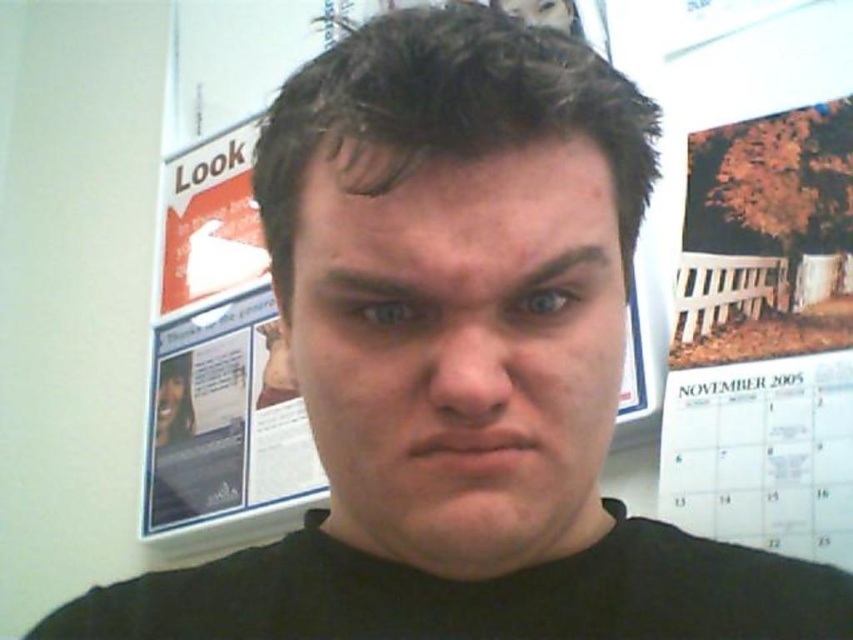
Between matte skin face at center and white paper calendar at right, which one has more height?

With more height is white paper calendar at right.

Which of these two, matte skin face at center or white paper calendar at right, stands shorter?

matte skin face at center

Between point (396, 458) and point (753, 480), which one is positioned behind?

The point (753, 480) is more distant.

Locate an element on the screen. Image resolution: width=853 pixels, height=640 pixels. matte skin face at center is located at coordinates (460, 349).